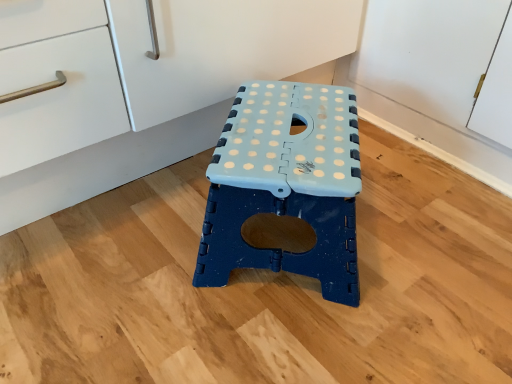
Locate an element on the screen. This screenshot has width=512, height=384. empty space that is to the right of blue plastic stool at center is located at coordinates (426, 235).